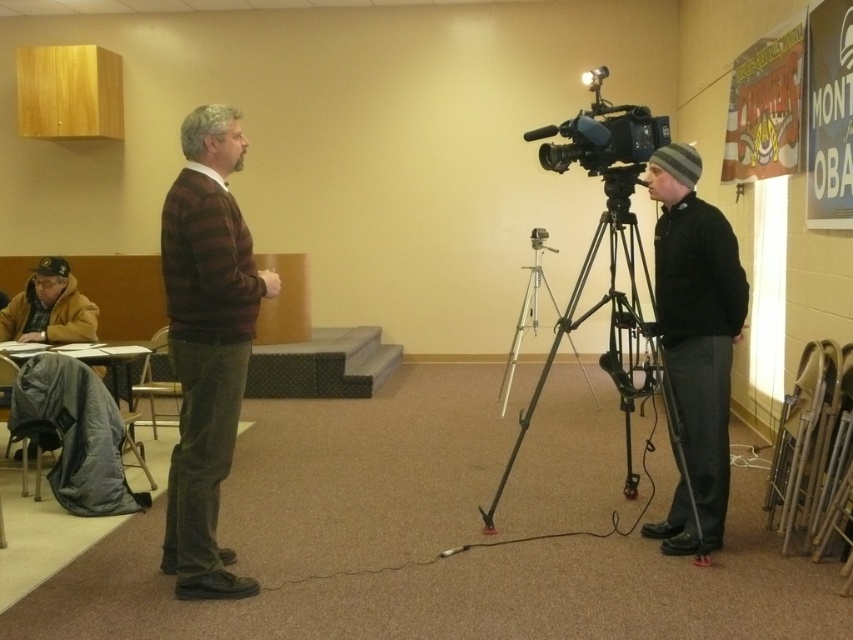
Question: Does black knit beanie at center have a smaller size compared to black plastic camera at center?

Choices:
 (A) no
 (B) yes

Answer: (A)

Question: Where is black metal tripod at center located in relation to black plastic camera at center in the image?

Choices:
 (A) right
 (B) left

Answer: (A)

Question: Is striped sweater at center to the left of black metal tripod at center from the viewer's perspective?

Choices:
 (A) no
 (B) yes

Answer: (B)

Question: Which point is closer to the camera?

Choices:
 (A) (711, 353)
 (B) (639, 308)
 (C) (635, 131)
 (D) (236, 294)

Answer: (D)

Question: Which point is farther to the camera?

Choices:
 (A) black plastic camera at center
 (B) striped sweater at center
 (C) black knit beanie at center

Answer: (A)

Question: Which point is closer to the camera taking this photo?

Choices:
 (A) (537, 388)
 (B) (660, 118)

Answer: (B)